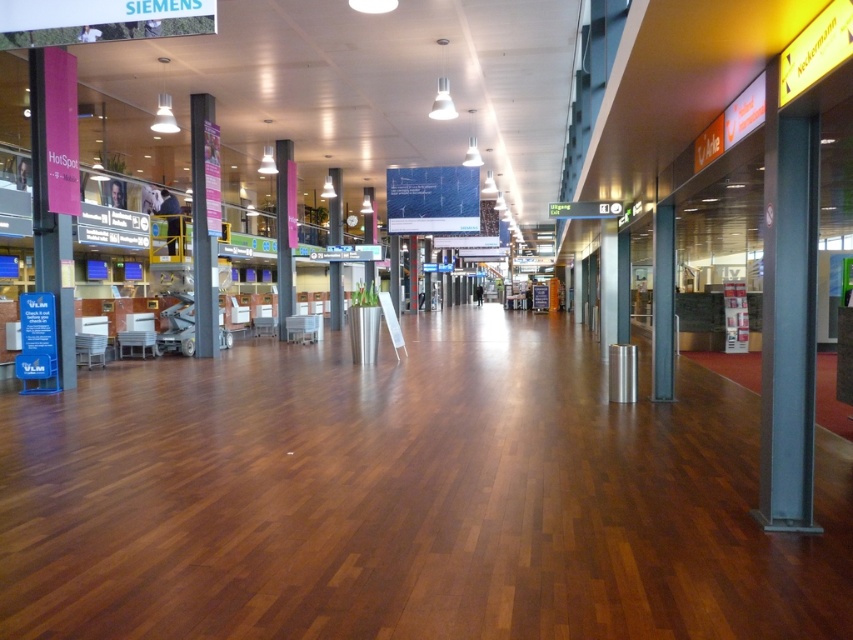
Question: Is metallic gray pillar at center behind metallic gray pillar at center-right?

Choices:
 (A) no
 (B) yes

Answer: (B)

Question: Which point is closer to the camera?

Choices:
 (A) metallic gray pillar at center-right
 (B) metallic gray pillar at center

Answer: (A)

Question: Does metallic gray pillar at center have a larger size compared to metallic gray pillar at center-right?

Choices:
 (A) no
 (B) yes

Answer: (B)

Question: Does metallic gray pillar at center appear over metallic gray pillar at center-right?

Choices:
 (A) no
 (B) yes

Answer: (B)

Question: Among these points, which one is nearest to the camera?

Choices:
 (A) (193, 154)
 (B) (662, 285)

Answer: (B)